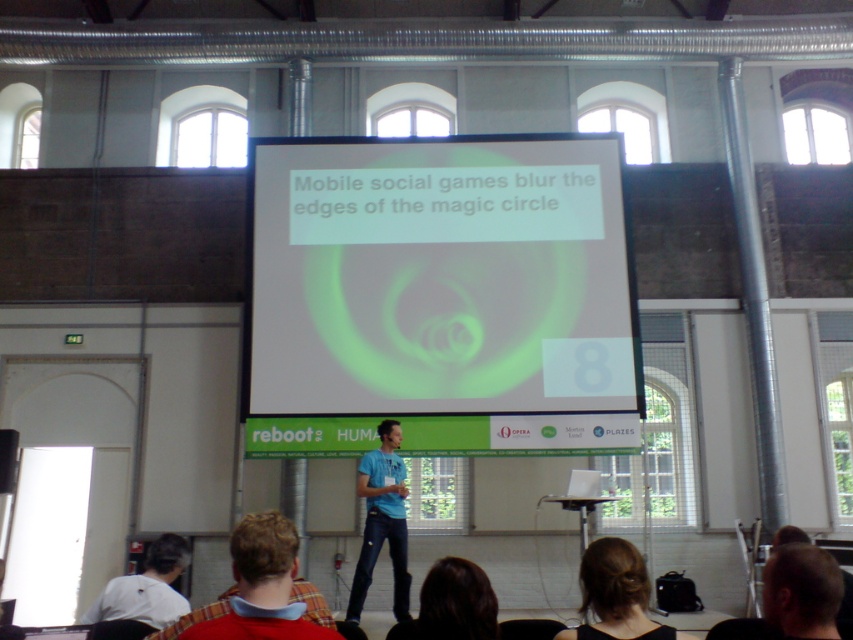
Question: Does dark brown hair at lower center have a smaller size compared to white matte shirt at lower left?

Choices:
 (A) no
 (B) yes

Answer: (B)

Question: Is blue denim jeans at center smaller than white matte shirt at lower left?

Choices:
 (A) yes
 (B) no

Answer: (B)

Question: Among these points, which one is nearest to the camera?

Choices:
 (A) (831, 611)
 (B) (283, 592)

Answer: (A)

Question: Estimate the real-world distances between objects in this image. Which object is farther from the white matte projection screen at center?

Choices:
 (A) plaid shirt at lower center
 (B) dark brown hair at lower center

Answer: (B)

Question: Considering the real-world distances, which object is closest to the plaid shirt at lower center?

Choices:
 (A) blonde hair at lower right
 (B) white matte shirt at lower left
 (C) white matte projection screen at center

Answer: (B)

Question: Observing the image, what is the correct spatial positioning of blonde hair at lower right in reference to white matte shirt at lower left?

Choices:
 (A) left
 (B) right

Answer: (B)